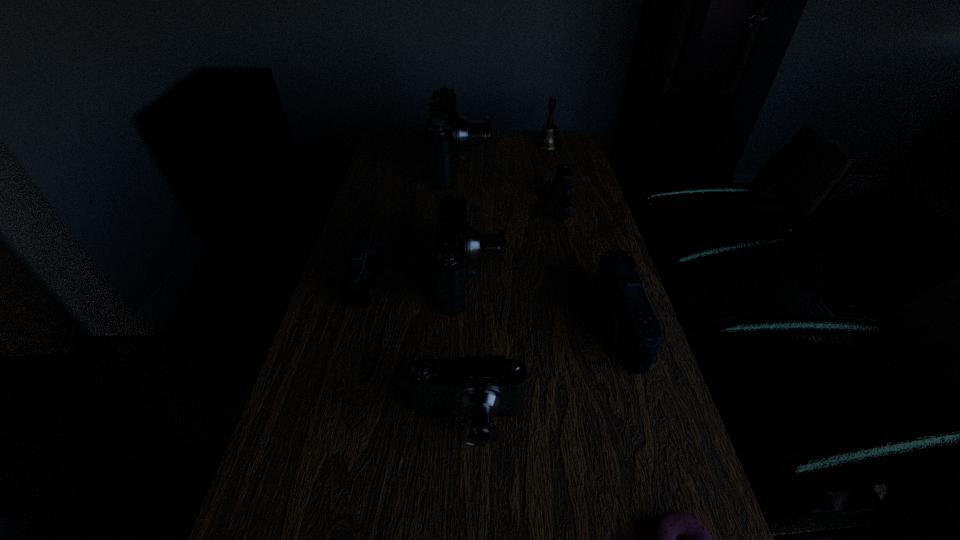
Find the location of `free point located on the front-facing side of the right black camcorder`. free point located on the front-facing side of the right black camcorder is located at coordinates (499, 325).

Where is `vacant space located on the front-facing side of the right black camcorder`? The width and height of the screenshot is (960, 540). vacant space located on the front-facing side of the right black camcorder is located at coordinates (454, 325).

This screenshot has height=540, width=960. I want to click on free spot located on the front-facing side of the nearest camcorder, so click(466, 511).

Locate an element on the screen. free space located on the front-facing side of the leftmost camcorder is located at coordinates (477, 280).

Find the location of a particular element. Image resolution: width=960 pixels, height=540 pixels. camcorder present at the far edge is located at coordinates (448, 133).

Identify the location of bell that is at the far edge. (548, 140).

At what (x,y) coordinates should I click in order to perform the action: click on object that is at the left edge. Please return your answer as a coordinate pair (x, y). This screenshot has width=960, height=540. Looking at the image, I should click on (365, 266).

The width and height of the screenshot is (960, 540). I want to click on bell situated at the right edge, so click(548, 140).

Locate an element on the screen. This screenshot has width=960, height=540. headset present at the right edge is located at coordinates (560, 191).

Find the location of a particular element. camcorder located at the right edge is located at coordinates (627, 319).